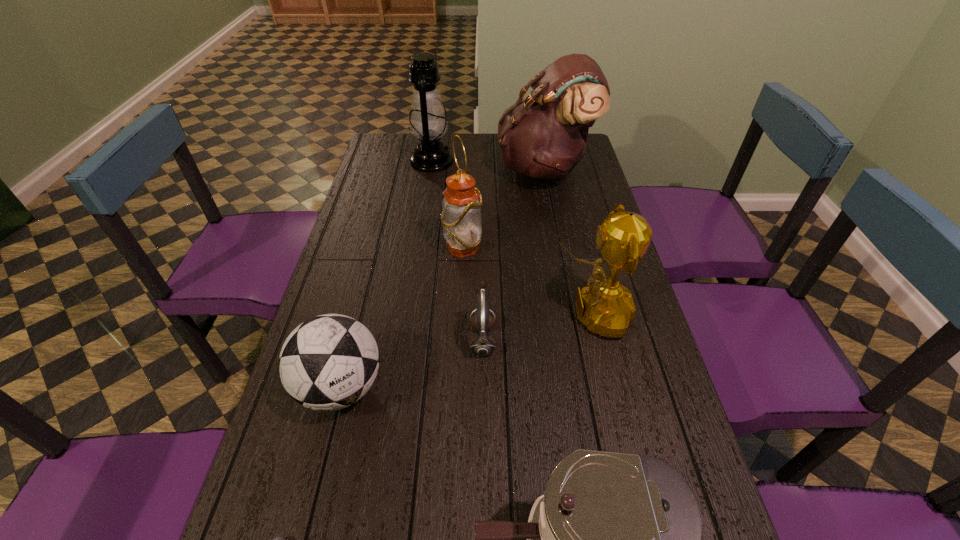
This screenshot has width=960, height=540. In order to click on oil lamp that is at the left edge in this screenshot , I will do `click(428, 122)`.

This screenshot has width=960, height=540. What are the coordinates of `soccer ball present at the left edge` in the screenshot? It's located at (329, 362).

Where is `satchel that is at the right edge`? The image size is (960, 540). satchel that is at the right edge is located at coordinates (544, 136).

Find the location of a particular element. The image size is (960, 540). award that is positioned at the right edge is located at coordinates (606, 307).

At what (x,y) coordinates should I click in order to perform the action: click on object at the far left corner. Please return your answer as a coordinate pair (x, y). This screenshot has width=960, height=540. Looking at the image, I should click on (428, 122).

Where is `object that is at the far right corner`? The image size is (960, 540). object that is at the far right corner is located at coordinates (544, 136).

Where is `vacant space at the left edge of the desktop`? The image size is (960, 540). vacant space at the left edge of the desktop is located at coordinates (288, 478).

This screenshot has width=960, height=540. Identify the location of vacant space at the right edge of the desktop. coord(643,330).

In the image, there is a desktop. Identify the location of vacant space at the far right corner. The height and width of the screenshot is (540, 960). (584, 160).

The image size is (960, 540). I want to click on free space between the third farthest object and the satchel, so click(x=503, y=208).